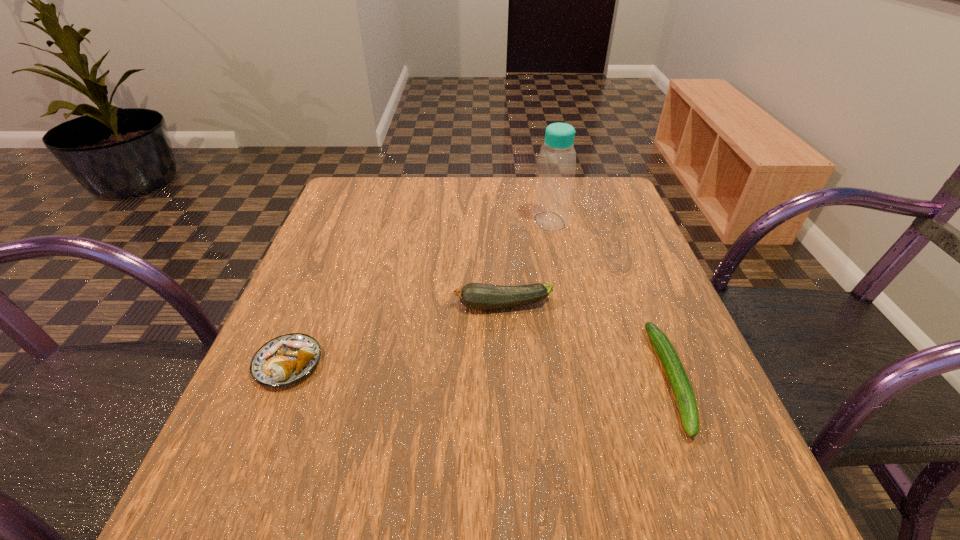
Where is `vacant space located at the blossom end of the third nearest object`? vacant space located at the blossom end of the third nearest object is located at coordinates (340, 306).

At what (x,y) coordinates should I click in order to perform the action: click on free space located at the blossom end of the third nearest object. Please return your answer as a coordinate pair (x, y). Looking at the image, I should click on (304, 306).

Where is `free spot located 0.400m on the back of the pastry`? free spot located 0.400m on the back of the pastry is located at coordinates (348, 217).

The width and height of the screenshot is (960, 540). Identify the location of free space located on the front-facing side of the right zucchini. pyautogui.click(x=728, y=523).

Where is `object that is positioned at the far edge`? The image size is (960, 540). object that is positioned at the far edge is located at coordinates (556, 166).

Identify the location of object at the left edge. (287, 359).

Locate an element on the screen. Image resolution: width=960 pixels, height=540 pixels. object that is at the right edge is located at coordinates (678, 379).

The height and width of the screenshot is (540, 960). Identify the location of vacant space at the far edge. (413, 214).

I want to click on free region at the near edge of the desktop, so click(514, 494).

The width and height of the screenshot is (960, 540). I want to click on free space at the left edge of the desktop, so click(334, 240).